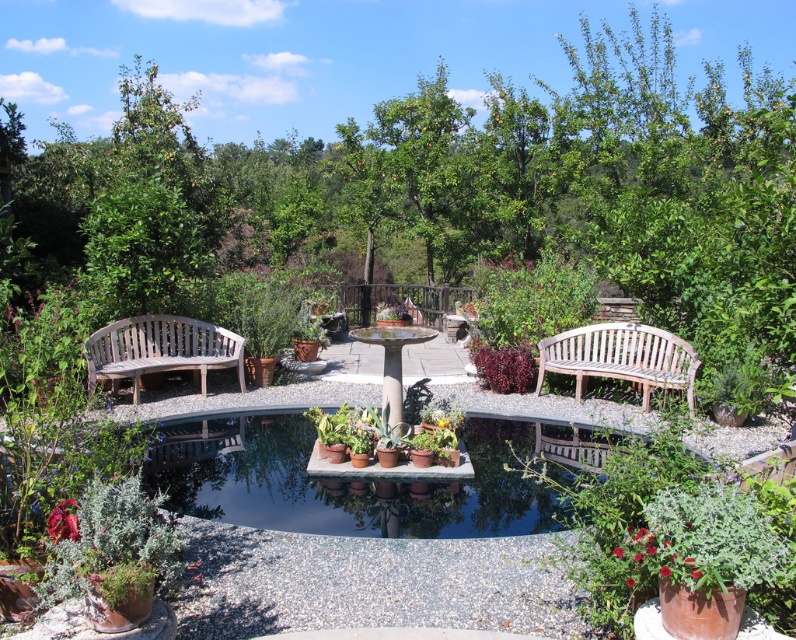
You are standing at the center of the garden facing the pond. There is a green textured plant at lower left. Where is the green textured plant relative to your position?

The green textured plant at lower left is located at point (116, 556), which places it to the lower left side of your position in the garden.

Consider the image. You are planning to place a new decorative statue in this garden scene. The statue is 1 meter tall. You want to ensure it doesn not block the view of the pond from the benches. Considering the sizes of the green textured plant at lower left and the green matte potted plants at center, which existing plant should you place the statue next to to avoid blocking the view?

The green textured plant at lower left is smaller than the green matte potted plants at center. To avoid blocking the view of the pond from the benches, the statue should be placed next to the green textured plant at lower left since it is shorter and less likely to obstruct the line of sight.

You are a gardener who needs to water the green matte potted plants at center from the wooden bench at right. Can you reach them with a standard 6.5 feet long watering hose?

The wooden bench at right and green matte potted plants at center are 8.24 feet apart. Since the watering hose is only 6.5 feet long, you cannot reach the plants from the bench.